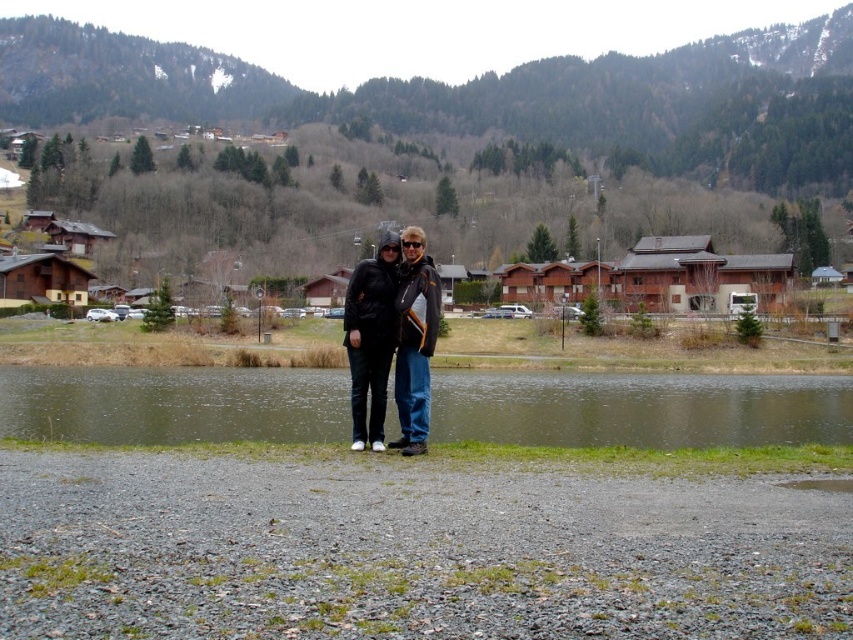
You are planning to take a photo of the greenish water at center and the matte black jackets at center from a drone. The drone has a camera with a 50mm lens. Considering the minimum focus distance of 1 meter for this lens, can you capture both objects in focus if they are 137.98 feet apart?

The greenish water at center and matte black jackets at center are 137.98 feet apart. At 50mm, the depth of field would likely allow both objects to be in focus since the distance between them is significant compared to the minimum focus distance. However, exact focus depends on aperture settings and camera positioning.

You are a photographer planning to take a wide shot of the scene. You want to ensure both the greenish water at center and the matte black jackets at center are clearly visible. Given their sizes, which object will occupy more of the frame?

The greenish water at center is bigger than the matte black jackets at center, so it will occupy more of the frame.

You are standing at the point closer to the edge of the water in the scene. There are two points marked in the image, one at coordinates point (231, 426) and another at point (404, 326). If you want to move towards the point that is further away from you, which coordinate should you head towards?

Point (231, 426) is behind point (404, 326), so to move towards the point further away from your current position at the edge of the water, you should head towards point (231, 426).